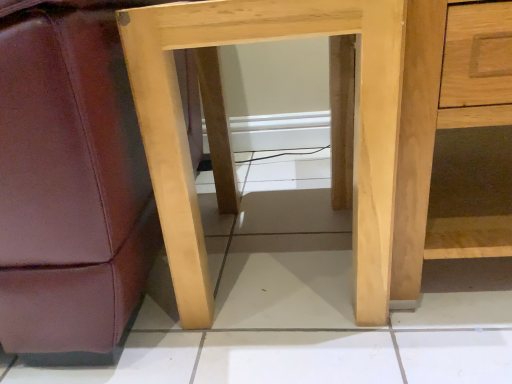
This screenshot has height=384, width=512. Identify the location of free space behind natural wood table at center. (280, 179).